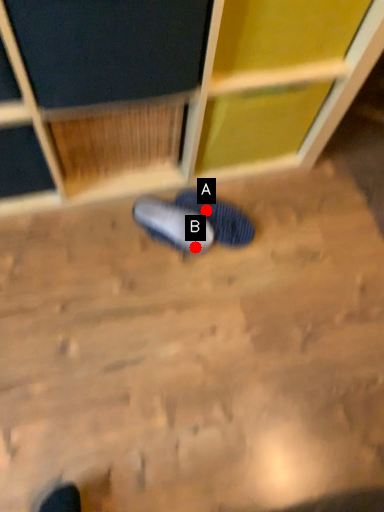
Question: Two points are circled on the image, labeled by A and B beside each circle. Which point is farther from the camera taking this photo?

Choices:
 (A) A is further
 (B) B is further

Answer: (A)